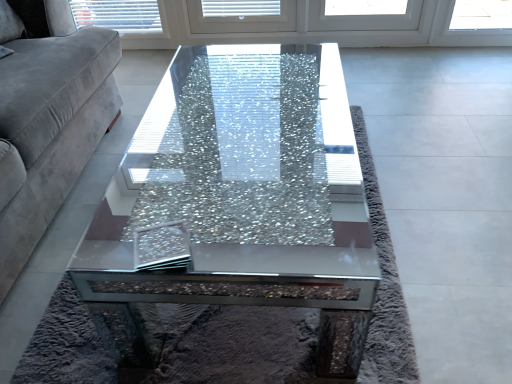
Question: Would you say velvet gray couch at left is to the left or to the right of cracked glass coffee table at center in the picture?

Choices:
 (A) left
 (B) right

Answer: (A)

Question: Looking at the image, does velvet gray couch at left seem bigger or smaller compared to cracked glass coffee table at center?

Choices:
 (A) big
 (B) small

Answer: (A)

Question: From the image's perspective, is velvet gray couch at left positioned above or below cracked glass coffee table at center?

Choices:
 (A) above
 (B) below

Answer: (A)

Question: Considering the positions of point (328, 304) and point (24, 233), is point (328, 304) closer or farther from the camera than point (24, 233)?

Choices:
 (A) farther
 (B) closer

Answer: (B)

Question: Is cracked glass coffee table at center in front of or behind velvet gray couch at left in the image?

Choices:
 (A) behind
 (B) front

Answer: (A)

Question: From the image's perspective, is cracked glass coffee table at center positioned above or below velvet gray couch at left?

Choices:
 (A) above
 (B) below

Answer: (B)

Question: Is cracked glass coffee table at center inside or outside of velvet gray couch at left?

Choices:
 (A) inside
 (B) outside

Answer: (B)